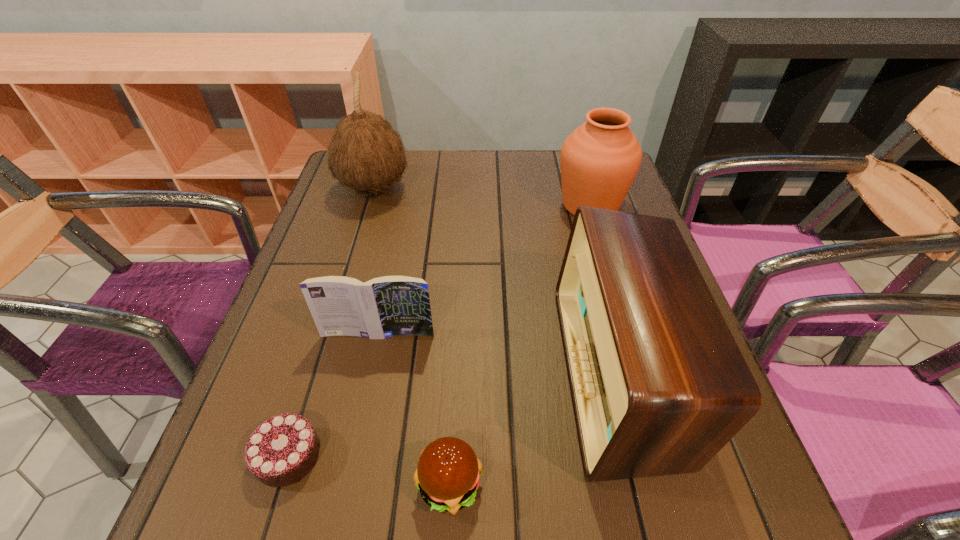
Locate an element on the screen. The image size is (960, 540). coconut is located at coordinates (366, 154).

Locate an element on the screen. The width and height of the screenshot is (960, 540). urn is located at coordinates (600, 159).

Image resolution: width=960 pixels, height=540 pixels. Identify the location of radio receiver. (659, 386).

What are the coordinates of `book` in the screenshot? It's located at (387, 306).

Locate an element on the screen. Image resolution: width=960 pixels, height=540 pixels. the fifth tallest object is located at coordinates (448, 474).

Where is `the shortest object`? The image size is (960, 540). the shortest object is located at coordinates (281, 451).

In order to click on free space located on the surface of the tallest object in this screenshot , I will do `click(434, 190)`.

Image resolution: width=960 pixels, height=540 pixels. In order to click on free space located 0.370m on the left of the urn in this screenshot , I will do `click(411, 205)`.

You are a GUI agent. You are given a task and a screenshot of the screen. Output one action in this format:
    pyautogui.click(x=<x>, y=<y>)
    Task: Click on the vacant region located 0.170m on the front-facing side of the radio receiver
    
    Given the screenshot: What is the action you would take?
    pyautogui.click(x=471, y=373)

The width and height of the screenshot is (960, 540). Identify the location of free space located on the front-facing side of the radio receiver. (477, 373).